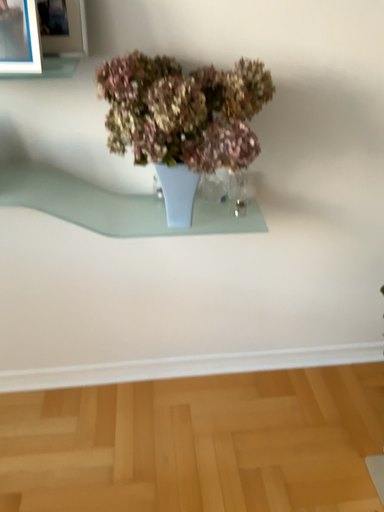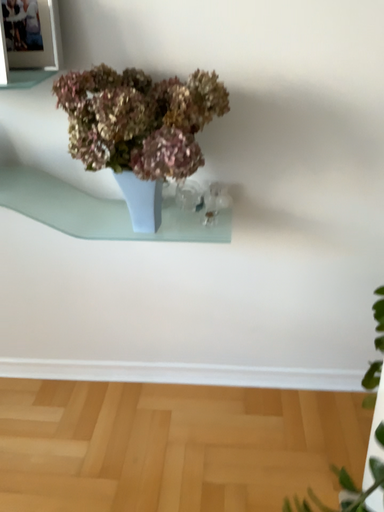
Question: Which way did the camera rotate in the video?

Choices:
 (A) rotated right
 (B) rotated left

Answer: (B)